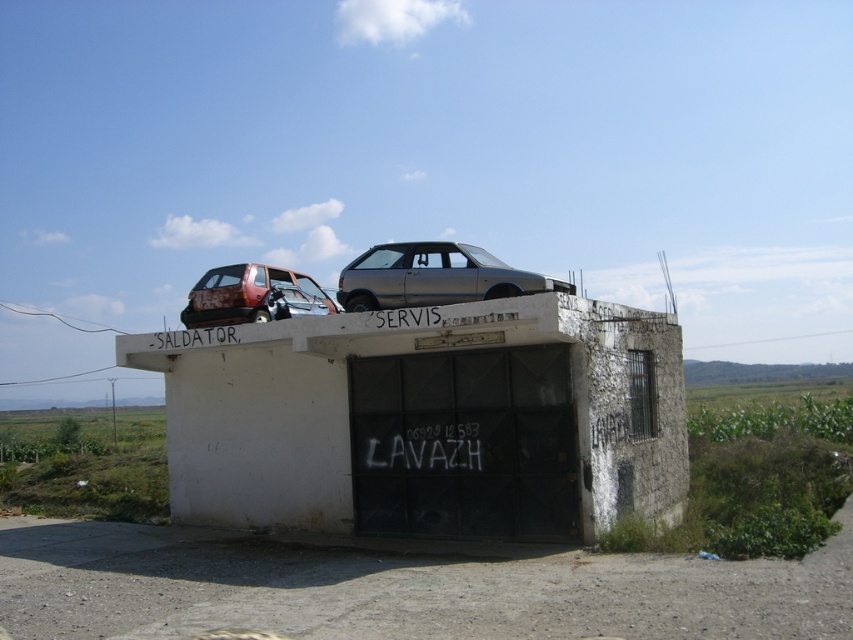
From the picture: You are a delivery person trying to deliver a package to the white concrete bunker at center. The metallic gray hatchback at center is blocking the entrance. Can you drive around the bunker to the right side to access the entrance?

The white concrete bunker at center is shorter than the metallic gray hatchback at center. Since the bunker is shorter, you can drive around it to the right side and access the entrance as the height difference allows visibility and clearance.

You are a delivery person trying to deliver a package to the white concrete bunker at center. You have a ladder that is 10 feet long. Can you use the ladder to reach the rusty metal hatchback at upper left from the bunker?

The distance between the white concrete bunker at center and the rusty metal hatchback at upper left is 12.01 feet. Since the ladder is only 10 feet long, it is not long enough to reach the rusty metal hatchback at upper left from the bunker.